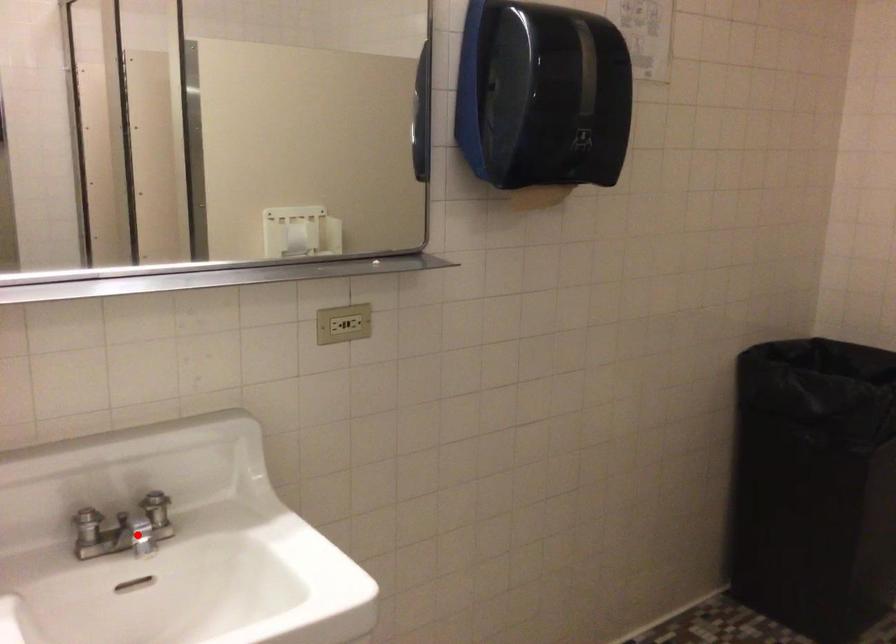
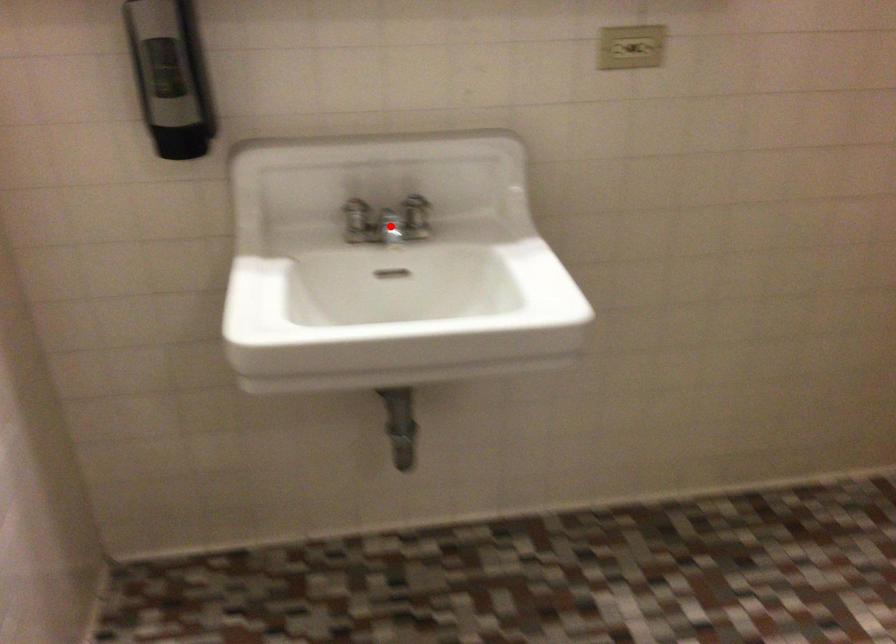
I am providing you with two images of the same scene from different viewpoints. A red point is marked on the first image and another point is marked on the second image. Is the red point in image1 aligned with the point shown in image2?

Yes